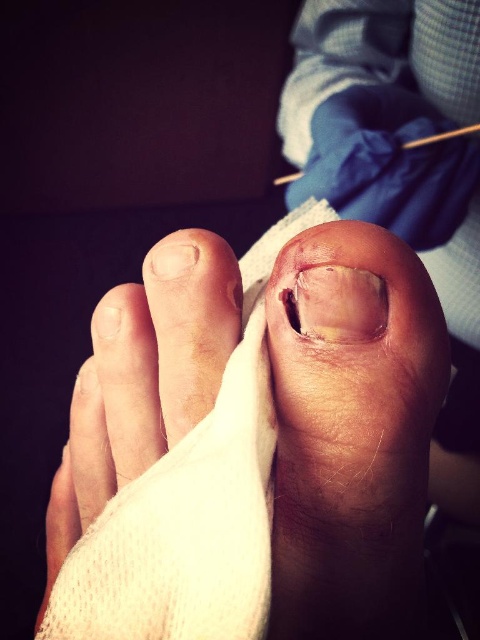
Question: Which object appears farthest from the camera in this image?

Choices:
 (A) yellowish skin at center
 (B) yellowish translucent nail at center

Answer: (B)

Question: Observing the image, what is the correct spatial positioning of yellowish skin at center in reference to white fabric bandage at center?

Choices:
 (A) below
 (B) above

Answer: (A)

Question: Does yellowish skin at center appear over dry skin toe at center?

Choices:
 (A) yes
 (B) no

Answer: (B)

Question: Which point is farther to the camera?

Choices:
 (A) yellowish skin at center
 (B) yellowish translucent nail at center

Answer: (B)

Question: Among these objects, which one is nearest to the camera?

Choices:
 (A) dry skin toe at center
 (B) white fabric bandage at center
 (C) yellowish skin at center

Answer: (B)

Question: Does dry skin toe at center have a greater width compared to yellowish translucent nail at center?

Choices:
 (A) no
 (B) yes

Answer: (B)